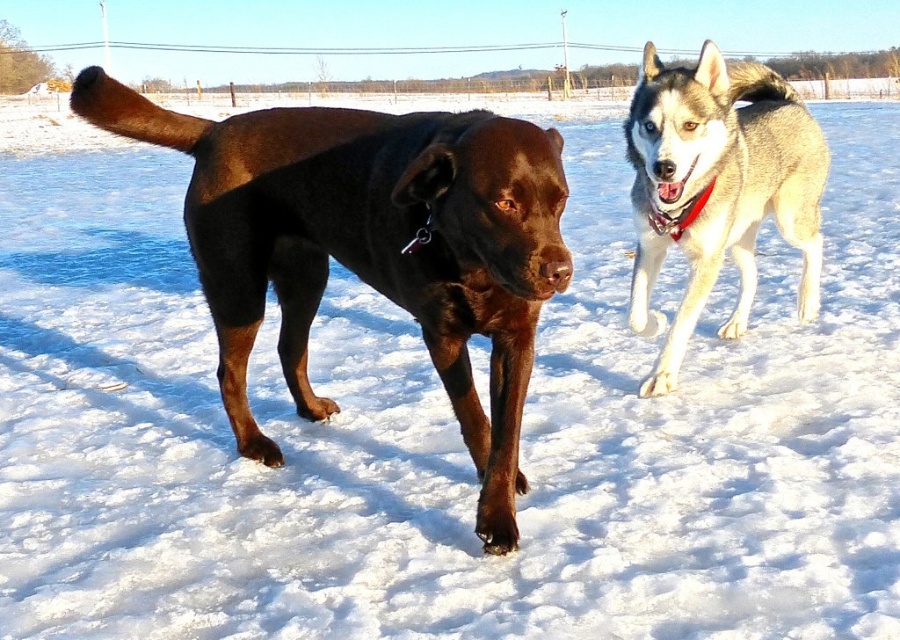
Who is higher up, shiny dark brown dog at center or silver-gray fur husky at upper right?

silver-gray fur husky at upper right is higher up.

Can you confirm if shiny dark brown dog at center is positioned to the right of silver-gray fur husky at upper right?

No, shiny dark brown dog at center is not to the right of silver-gray fur husky at upper right.

I want to click on shiny dark brown dog at center, so click(x=370, y=246).